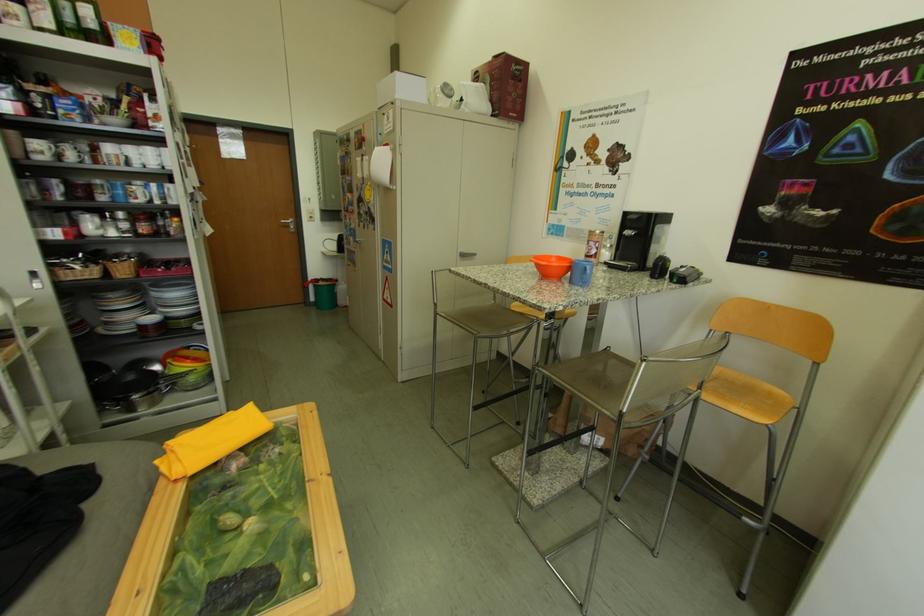
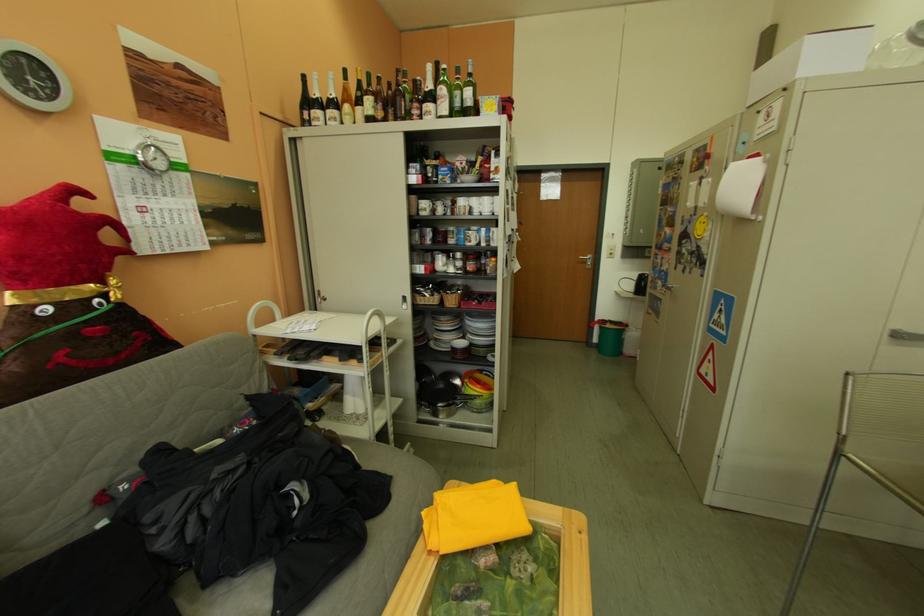
Find the pixel in the second image that matches point 327,288 in the first image.

(613, 330)